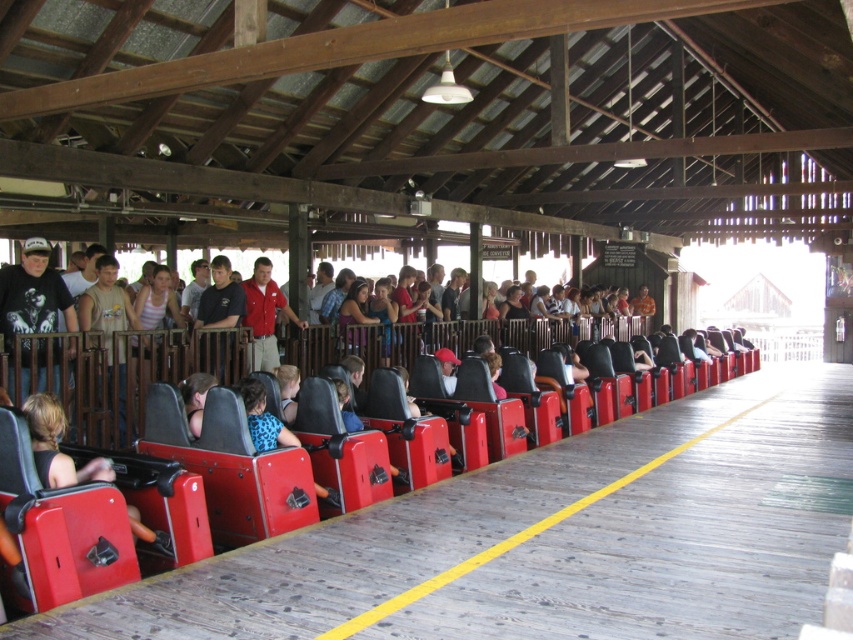
You are a ride operator standing at the entrance of the ride and see the matte black seat at center and the red cotton shirt at center. Which object is closer to you?

The matte black seat at center is closer to you than the red cotton shirt at center.

You are a ride inspector checking the safety of the seats. You notice a red cotton shirt at center lying on the matte black seat at center. To ensure the shirt doesn not interfere with the safety harness, you need to know if the seat is wider than the shirt. Can you confirm this?

The matte black seat at center is wider than the red cotton shirt at center, so the shirt will not interfere with the safety harness.